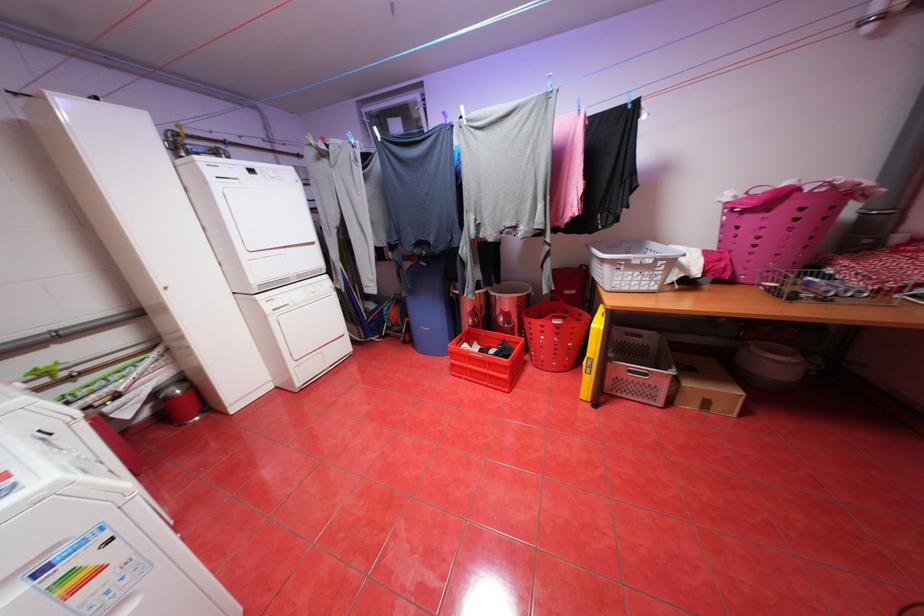
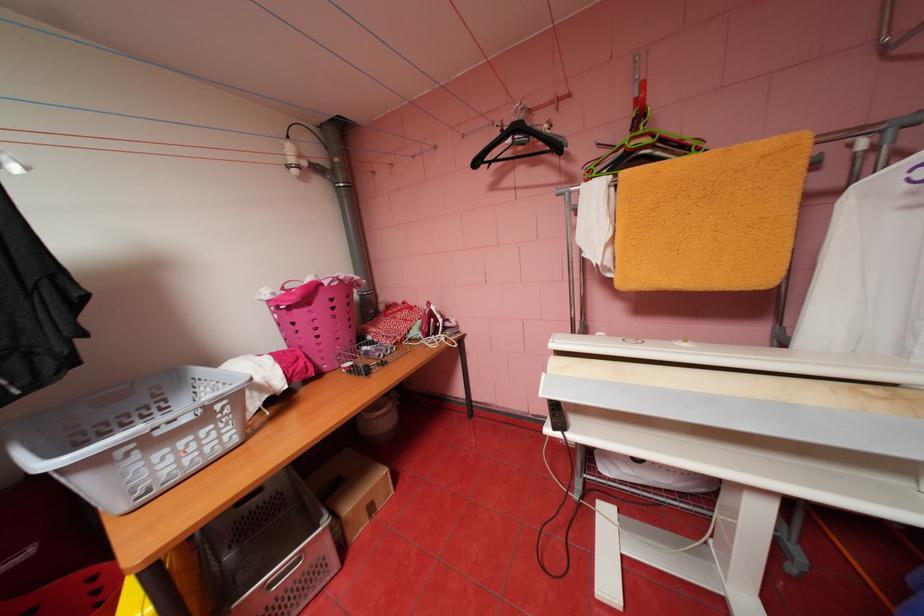
Locate, in the second image, the point that corresponds to [639,281] in the first image.

(187, 460)